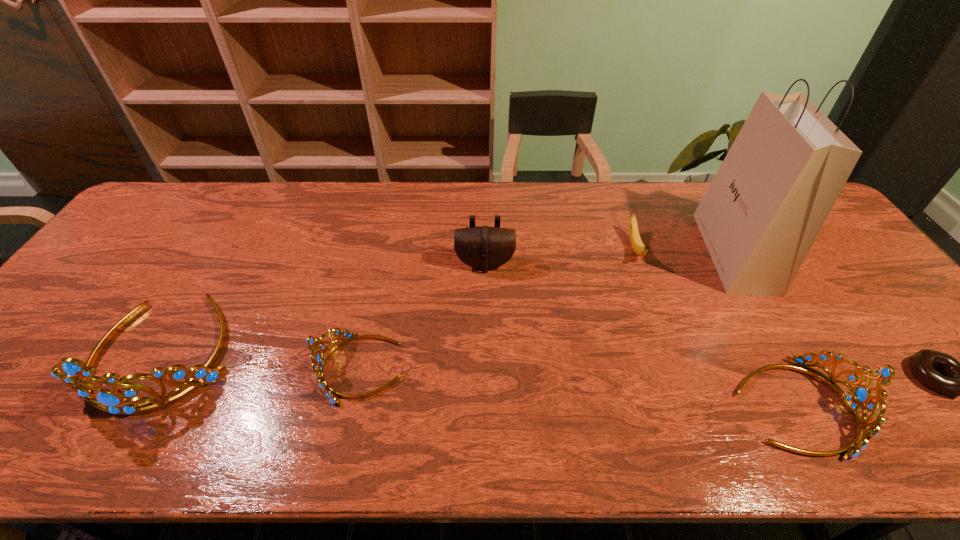
Please determine a free point for an extra tiara to ensure balance. Please provide its 2D coordinates. Your answer should be formatted as a tuple, i.e. [(x, y)], where the tuple contains the x and y coordinates of a point satisfying the conditions above.

[(571, 387)]